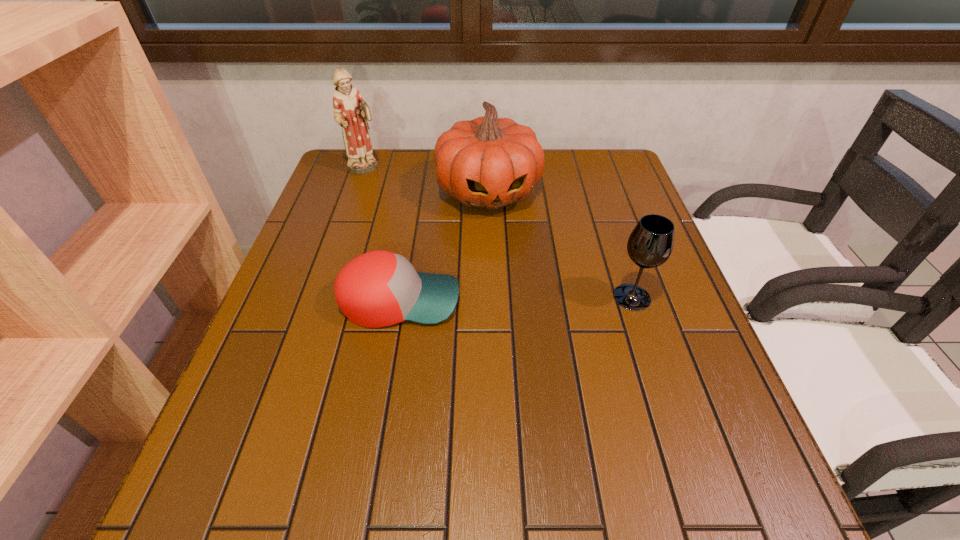
This screenshot has width=960, height=540. What are the coordinates of `free space located on the front-facing side of the tallest object` in the screenshot? It's located at (380, 184).

Locate an element on the screen. This screenshot has height=540, width=960. vacant area situated on the front-facing side of the tallest object is located at coordinates (411, 217).

You are a GUI agent. You are given a task and a screenshot of the screen. Output one action in this format:
    pyautogui.click(x=<x>, y=<y>)
    Task: Click on the free space located on the front-facing side of the tallest object
    This screenshot has width=960, height=540.
    Given the screenshot: What is the action you would take?
    pyautogui.click(x=385, y=189)

You are a GUI agent. You are given a task and a screenshot of the screen. Output one action in this format:
    pyautogui.click(x=<x>, y=<y>)
    Task: Click on the pumpkin that is positioned at the far edge
    This screenshot has height=540, width=960.
    Given the screenshot: What is the action you would take?
    [486, 162]

Identify the location of figurine positioned at the far edge. This screenshot has height=540, width=960. (351, 112).

At what (x,y) coordinates should I click in order to perform the action: click on baseball cap present at the left edge. Please return your answer as a coordinate pair (x, y). This screenshot has width=960, height=540. Looking at the image, I should click on (379, 288).

Identify the location of figurine present at the left edge. (351, 112).

I want to click on object present at the right edge, so click(x=650, y=244).

Image resolution: width=960 pixels, height=540 pixels. Identify the location of object at the far left corner. (351, 112).

Where is `vacant position at the far edge of the desktop`? The width and height of the screenshot is (960, 540). vacant position at the far edge of the desktop is located at coordinates (566, 160).